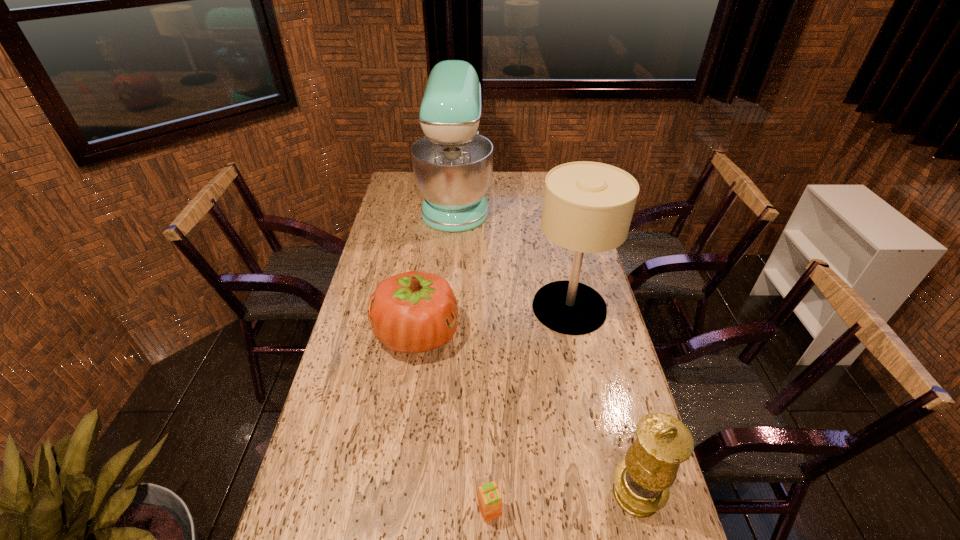
Image resolution: width=960 pixels, height=540 pixels. Identify the location of mixer. (452, 164).

The width and height of the screenshot is (960, 540). I want to click on table lamp, so click(588, 206).

What are the coordinates of `the third shortest object` in the screenshot? It's located at (642, 482).

At what (x,y) coordinates should I click in order to perform the action: click on the second shortest object. Please return your answer as a coordinate pair (x, y). Looking at the image, I should click on (412, 312).

Where is `orange juice`? The image size is (960, 540). orange juice is located at coordinates (489, 498).

Identify the location of vacant region located at the base of the mixer. The width and height of the screenshot is (960, 540). [x=517, y=200].

Find the location of a particular element. The width and height of the screenshot is (960, 540). vacant position located on the left of the table lamp is located at coordinates (422, 308).

The width and height of the screenshot is (960, 540). In order to click on free space located on the back of the oil lamp in this screenshot , I will do `click(614, 409)`.

Image resolution: width=960 pixels, height=540 pixels. In order to click on vacant space situated 0.070m on the side of the second shortest object with the cute face in this screenshot , I will do `click(480, 334)`.

Identify the location of vacant space located 0.270m on the back of the orange juice. (488, 401).